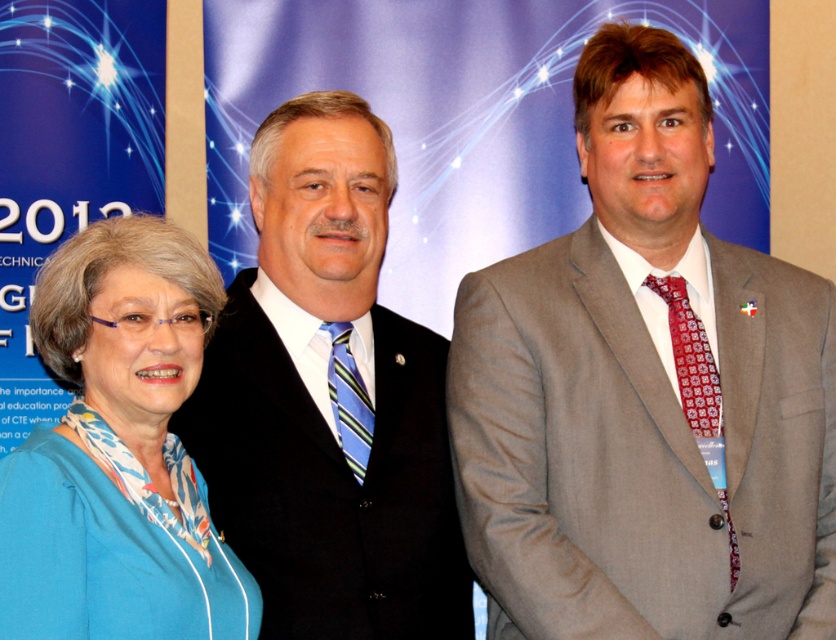
Which is more to the right, gray suit at center or blue fabric blouse at center?

Positioned to the right is gray suit at center.

Which is in front, point (599, 566) or point (13, 604)?

Point (13, 604) is in front.

The height and width of the screenshot is (640, 836). What are the coordinates of `gray suit at center` in the screenshot? It's located at (645, 394).

Does point (381, 513) lie in front of point (69, 240)?

That is False.

Can you confirm if black suit at center is positioned above blue fabric blouse at center?

Correct, black suit at center is located above blue fabric blouse at center.

Find the location of `black suit at center`. black suit at center is located at coordinates (329, 400).

What do you see at coordinates (645, 394) in the screenshot? I see `gray suit at center` at bounding box center [645, 394].

Image resolution: width=836 pixels, height=640 pixels. What are the coordinates of `gray suit at center` in the screenshot? It's located at (645, 394).